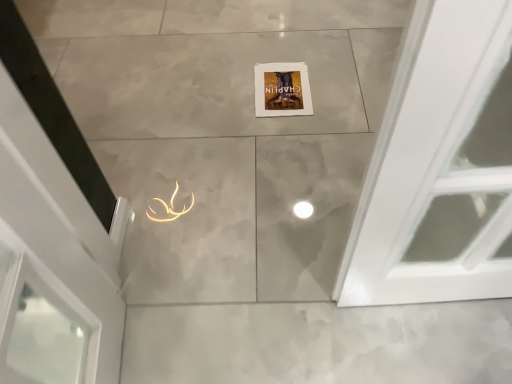
This screenshot has height=384, width=512. Describe the element at coordinates (282, 89) in the screenshot. I see `matte paper postcard at center` at that location.

Locate an element on the screen. matte paper postcard at center is located at coordinates (282, 89).

This screenshot has height=384, width=512. Find the location of `matte paper postcard at center`. matte paper postcard at center is located at coordinates (282, 89).